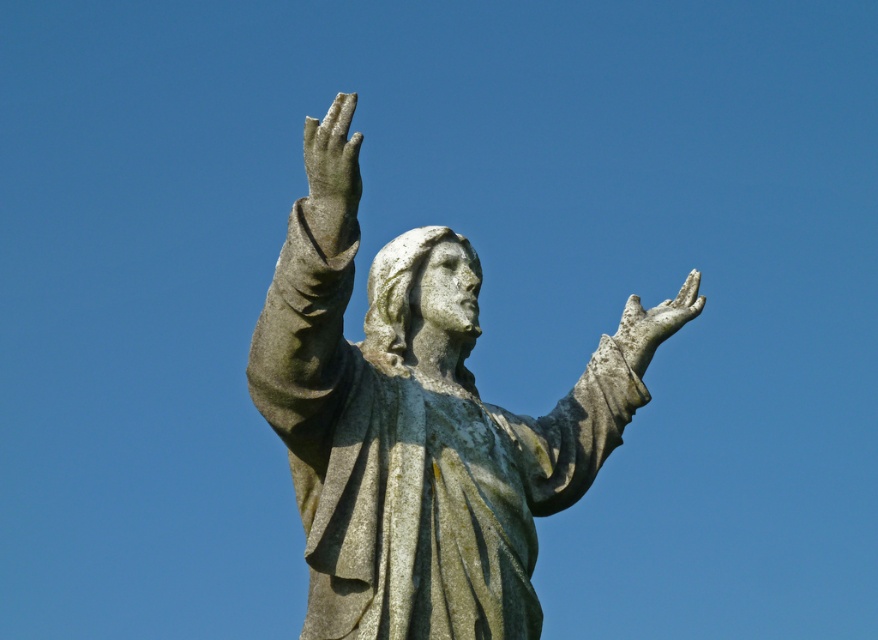
You are standing at the origin point in the image. Where is the gray stone statue at center located in terms of coordinates?

The gray stone statue at center is located at coordinates point (416, 440).

You are an art conservator examining the statue. You notice the gray stone hand at upper center and the gray stone statue at center. Which object is positioned to the right of the other?

The gray stone statue at center is positioned to the right of the gray stone hand at upper center.

You are a photographer standing at point A, which is located at coordinates (416, 440). You want to capture a photo of the gray stone statue at center. Is the statue within your current line of sight from this position?

The gray stone statue at center is located exactly at point A, so yes, the statue is directly in front of you and within your line of sight.